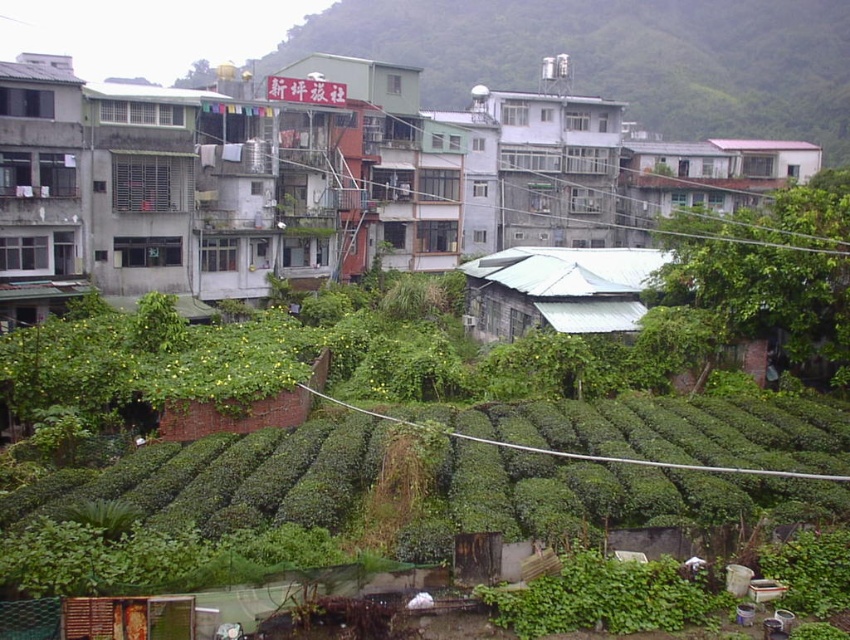
From the picture: Can you confirm if green matte building at upper center is positioned below gray concrete building at center?

No, green matte building at upper center is not below gray concrete building at center.

Image resolution: width=850 pixels, height=640 pixels. Describe the element at coordinates (618, 56) in the screenshot. I see `green matte building at upper center` at that location.

Who is more distant from viewer, [845,147] or [518,237]?

Point [845,147]

You are a GUI agent. You are given a task and a screenshot of the screen. Output one action in this format:
    pyautogui.click(x=<x>, y=<y>)
    Task: Click on the green matte building at upper center
    
    Given the screenshot: What is the action you would take?
    pyautogui.click(x=618, y=56)

Is point (319, 500) positioned after point (550, 236)?

No, (319, 500) is in front of (550, 236).

Is point (3, 547) positioned before point (523, 193)?

Yes, it is in front of point (523, 193).

Who is more distant from viewer, (785,480) or (618,120)?

Positioned behind is point (618,120).

Locate an element on the screen. Image resolution: width=850 pixels, height=640 pixels. green leafy hedge at lower center is located at coordinates [x=235, y=477].

Can you confirm if green leafy hedge at lower center is positioned to the left of green matte building at upper center?

Yes, green leafy hedge at lower center is to the left of green matte building at upper center.

Measure the distance between point [652,432] and camera.

The distance of point [652,432] from camera is 31.39 meters.

Measure the distance between point (836, 461) and camera.

Point (836, 461) and camera are 92.49 feet apart from each other.

You are a GUI agent. You are given a task and a screenshot of the screen. Output one action in this format:
    pyautogui.click(x=<x>, y=<y>)
    Task: Click on the green leafy hedge at lower center
    This screenshot has height=640, width=850.
    Given the screenshot: What is the action you would take?
    pyautogui.click(x=235, y=477)